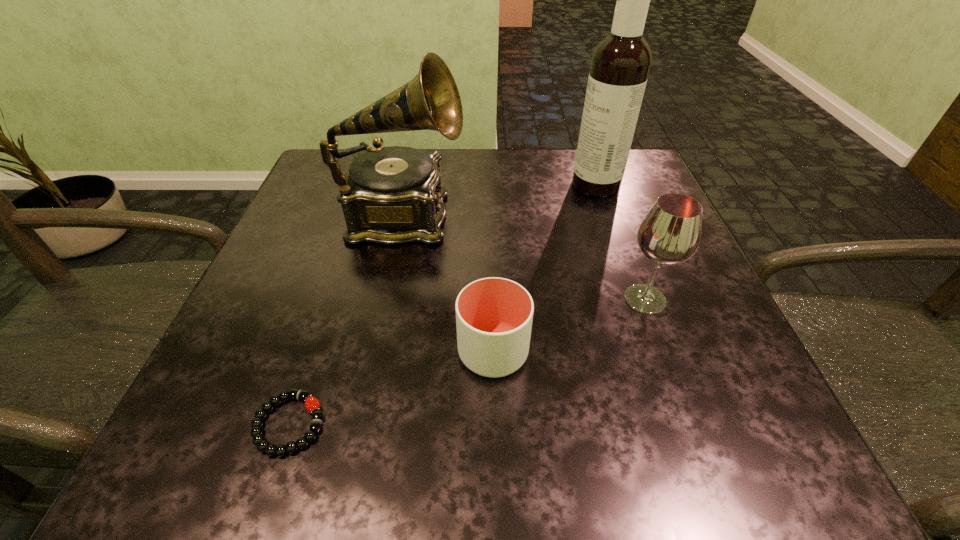
This screenshot has height=540, width=960. I want to click on unoccupied area between the wineglass and the cup, so click(569, 326).

You are a GUI agent. You are given a task and a screenshot of the screen. Output one action in this format:
    pyautogui.click(x=<x>, y=<y>)
    Task: Click on the object that can be found as the third closest to the bracelet
    
    Given the screenshot: What is the action you would take?
    pyautogui.click(x=670, y=233)

Identify which object is the fourth closest to the third tallest object. Please provide its 2D coordinates. Your answer should be formatted as a tuple, i.e. [(x, y)], where the tuple contains the x and y coordinates of a point satisfying the conditions above.

[(312, 404)]

The image size is (960, 540). I want to click on free location that satisfies the following two spatial constraints: 1. on the label side of the dishwasher detergent; 2. on the right side of the third farthest object, so click(636, 299).

The height and width of the screenshot is (540, 960). Identify the location of vacant space that satisfies the following two spatial constraints: 1. on the label side of the dishwasher detergent; 2. on the front side of the cup. (654, 352).

Locate an element on the screen. The width and height of the screenshot is (960, 540). vacant position in the image that satisfies the following two spatial constraints: 1. on the back side of the shortest object; 2. on the left side of the wineglass is located at coordinates (331, 299).

Where is `vacant space that satisfies the following two spatial constraints: 1. on the horn of the phonograph record; 2. on the front side of the bracelet`? The width and height of the screenshot is (960, 540). vacant space that satisfies the following two spatial constraints: 1. on the horn of the phonograph record; 2. on the front side of the bracelet is located at coordinates (358, 424).

Locate an element on the screen. The width and height of the screenshot is (960, 540). free spot that satisfies the following two spatial constraints: 1. on the back side of the third tallest object; 2. on the horn of the phonograph record is located at coordinates (615, 219).